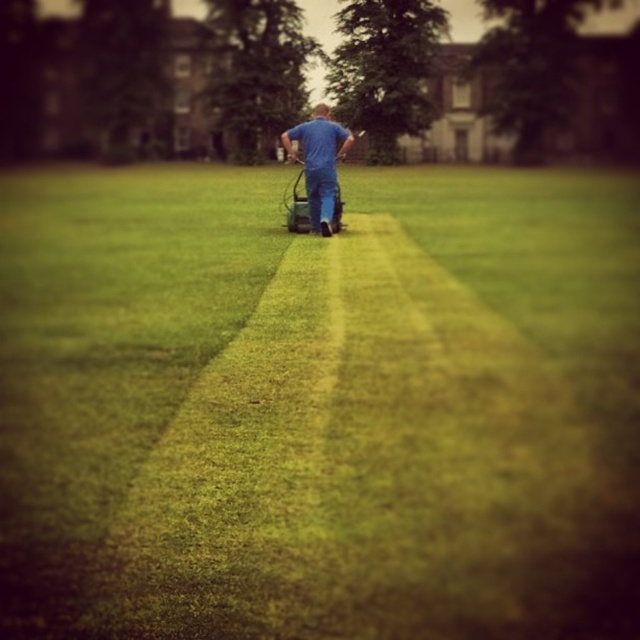
Question: Is green grass at center thinner than blue denim jeans at center?

Choices:
 (A) no
 (B) yes

Answer: (A)

Question: In this image, where is green grass at center located relative to blue denim jeans at center?

Choices:
 (A) right
 (B) left

Answer: (B)

Question: Does green grass at center appear on the right side of blue denim jeans at center?

Choices:
 (A) yes
 (B) no

Answer: (B)

Question: Which object is farther from the camera taking this photo?

Choices:
 (A) green grass at center
 (B) blue denim jeans at center

Answer: (B)

Question: Which point appears farthest from the camera in this image?

Choices:
 (A) (256, 500)
 (B) (291, 141)

Answer: (B)